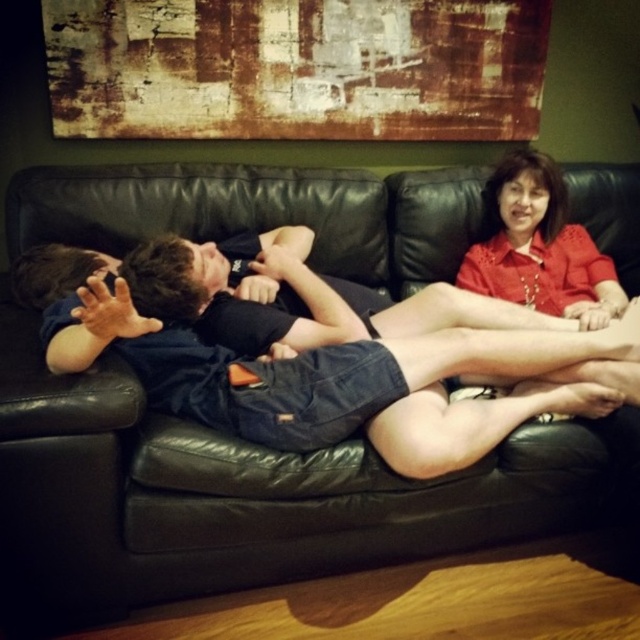
You are a delivery person who needs to place a small package on the black leather couch at center without disturbing the denim shorts at center. Is there enough space between them for the package?

The distance between the black leather couch at center and denim shorts at center is 8.33 inches, so there is sufficient space to place the small package without disturbing the denim shorts at center.